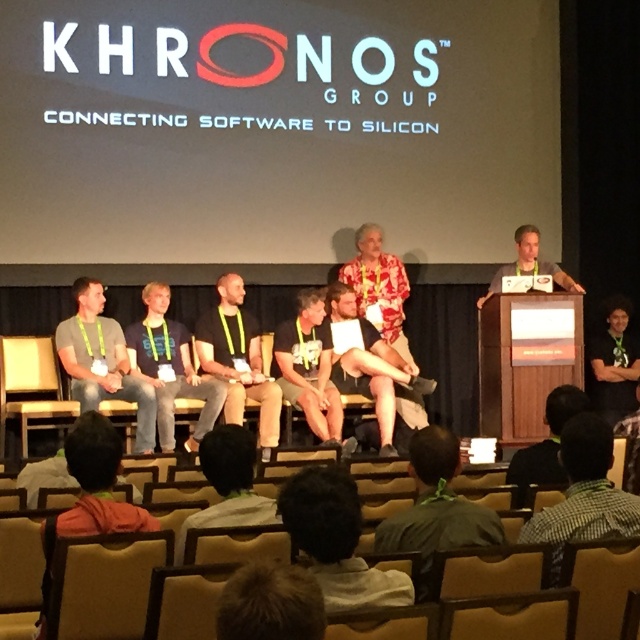
You are organizing a photo shoot and need to ensure that the green checkered shirt at lower right and the dark brown wood podium at center are both visible in the frame. Given their sizes, which object should you prioritize positioning closer to the camera to maintain clarity?

The green checkered shirt at lower right should be positioned closer to the camera since its width is larger than the dark brown wood podium at center, ensuring both can be clearly seen in the frame.

What is located at the coordinate point (586, 492) in the image?

The green checkered shirt at lower right is located at point (586, 492).